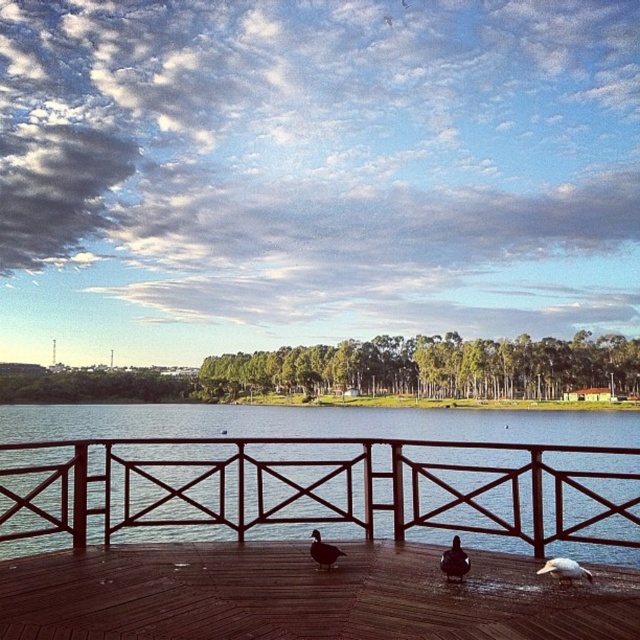
Looking at this image, how distant is brown wooden rail at center from white feathered bird at lower right?

4.73 meters

Measure the distance between point (560, 536) and camera.

A distance of 6.29 meters exists between point (560, 536) and camera.

The width and height of the screenshot is (640, 640). I want to click on brown wooden rail at center, so [x=321, y=486].

Who is more distant from viewer, (547,568) or (314,548)?

Positioned behind is point (314,548).

I want to click on white feathered bird at lower right, so click(x=564, y=570).

Between dark brown duck at center and dark brown feathers at center, which one has more height?

dark brown duck at center is taller.

The width and height of the screenshot is (640, 640). In order to click on dark brown duck at center in this screenshot , I will do `click(454, 561)`.

What do you see at coordinates (454, 561) in the screenshot?
I see `dark brown duck at center` at bounding box center [454, 561].

At what (x,y) coordinates should I click in order to perform the action: click on dark brown duck at center. Please return your answer as a coordinate pair (x, y). The image size is (640, 640). Looking at the image, I should click on (454, 561).